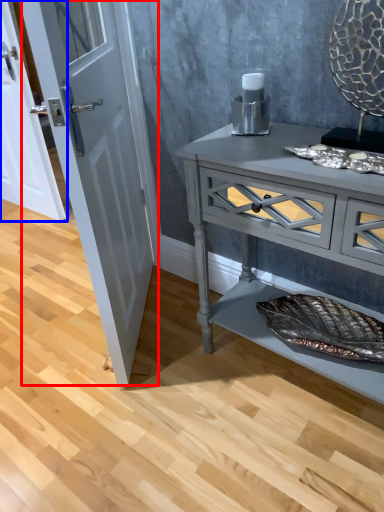
Question: Which object is closer to the camera taking this photo, door (highlighted by a red box) or door (highlighted by a blue box)?

Choices:
 (A) door
 (B) door

Answer: (A)